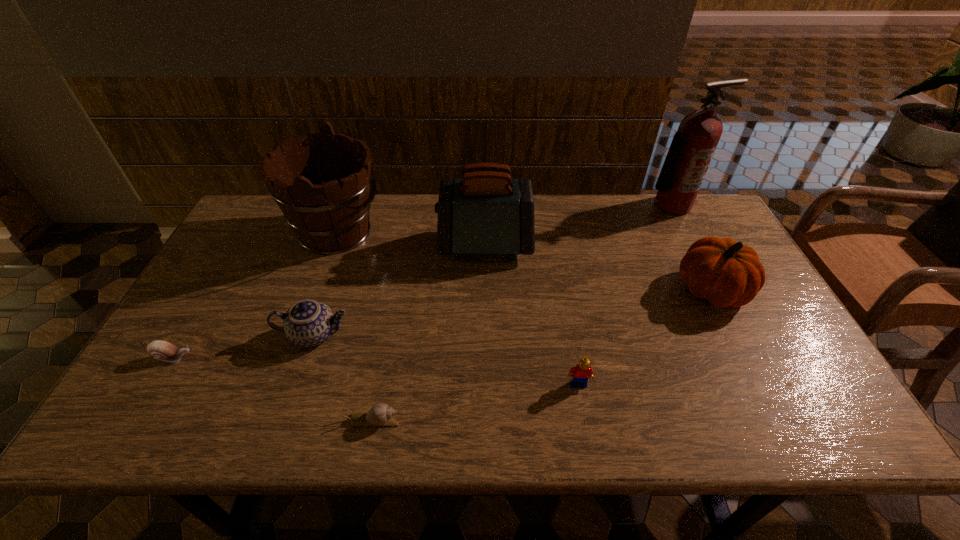
The height and width of the screenshot is (540, 960). I want to click on unoccupied position between the toaster and the farther escargot, so click(329, 301).

At what (x,y) coordinates should I click in order to perform the action: click on free space between the pumpkin and the fifth tallest object. Please return your answer as a coordinate pair (x, y). Image resolution: width=960 pixels, height=540 pixels. Looking at the image, I should click on (513, 313).

The height and width of the screenshot is (540, 960). Find the location of `vacant point located between the fifth object from right to left and the farther escargot`. vacant point located between the fifth object from right to left and the farther escargot is located at coordinates (274, 389).

This screenshot has height=540, width=960. I want to click on blank region between the chinaware and the fourth object from right to left, so click(399, 291).

Find the location of a particular element. Image resolution: width=960 pixels, height=540 pixels. free space between the Lego and the chinaware is located at coordinates (446, 360).

Select which object is the third closest to the sixth tallest object. Please provide its 2D coordinates. Your answer should be formatted as a tuple, i.e. [(x, y)], where the tuple contains the x and y coordinates of a point satisfying the conditions above.

[(486, 212)]

Identify which object is the fourth closest to the fire extinguisher. Please provide its 2D coordinates. Your answer should be formatted as a tuple, i.e. [(x, y)], where the tuple contains the x and y coordinates of a point satisfying the conditions above.

[(332, 217)]

Find the location of a particular element. This screenshot has width=960, height=540. blank space that satisfies the following two spatial constraints: 1. on the front of the tallest object near the operation label; 2. on the front-facing side of the fourth object from right to left is located at coordinates pos(693,246).

The width and height of the screenshot is (960, 540). I want to click on vacant space that satisfies the following two spatial constraints: 1. on the front of the tallest object near the operation label; 2. on the front-facing side of the farther escargot, so click(752, 357).

Find the location of `free space that satisfies the following two spatial constraints: 1. on the front of the fire extinguisher near the operation label; 2. on the shell of the nearer escargot`. free space that satisfies the following two spatial constraints: 1. on the front of the fire extinguisher near the operation label; 2. on the shell of the nearer escargot is located at coordinates (784, 420).